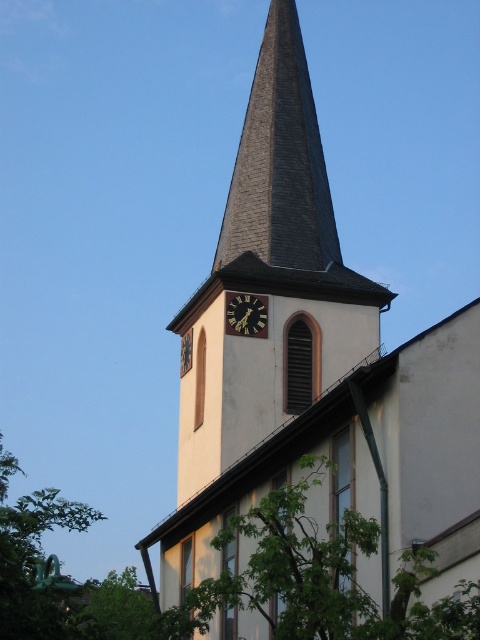
Question: Which object is the farthest from the gold metallic clock at center?

Choices:
 (A) dark gray shingles at center
 (B) green leafy tree at lower center
 (C) white smooth steeple at center

Answer: (B)

Question: Which point is farther from the camera taking this photo?

Choices:
 (A) (225, 216)
 (B) (288, 376)
 (C) (260, 324)
 (D) (340, 618)

Answer: (A)

Question: Is white smooth steeple at center further to the viewer compared to green leafy tree at lower center?

Choices:
 (A) yes
 (B) no

Answer: (A)

Question: Which of the following is the farthest from the observer?

Choices:
 (A) green leafy tree at lower center
 (B) gold metallic clock at center
 (C) dark gray shingles at center

Answer: (C)

Question: Is white smooth steeple at center further to camera compared to dark gray shingles at center?

Choices:
 (A) no
 (B) yes

Answer: (A)

Question: Can you confirm if white smooth steeple at center is positioned above green leafy tree at lower center?

Choices:
 (A) yes
 (B) no

Answer: (A)